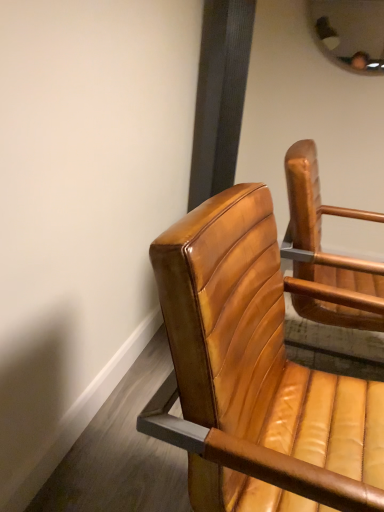
Describe the element at coordinates (254, 375) in the screenshot. The image size is (384, 512). I see `matte brown leather chair at center` at that location.

Measure the distance between point (161, 430) and camera.

23.90 inches.

Locate an element on the screen. matte brown leather chair at center is located at coordinates (254, 375).

At what (x,y) coordinates should I click in order to perform the action: click on matte brown leather chair at center. Please return your answer as a coordinate pair (x, y). Looking at the image, I should click on (254, 375).